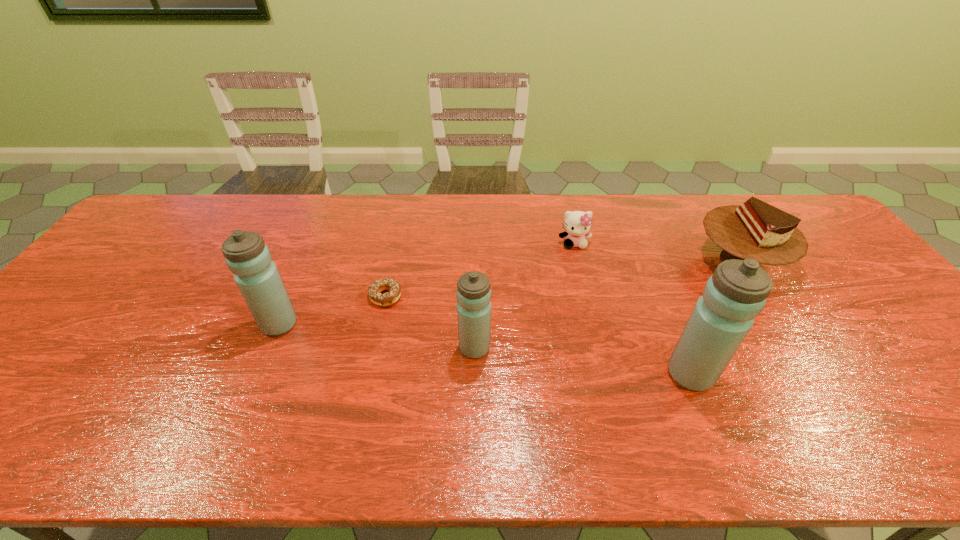
Please show where to add a water bottle on the right while keeping spacing even. Please provide its 2D coordinates. Your answer should be formatted as a tuple, i.e. [(x, y)], where the tuple contains the x and y coordinates of a point satisfying the conditions above.

[(930, 403)]